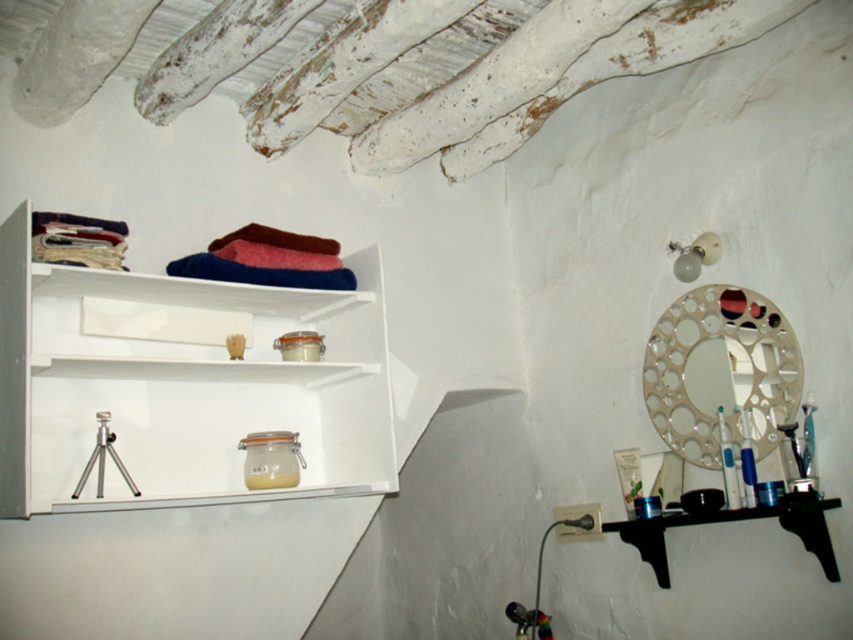
Is white glossy shelves at upper left to the right of black wood shelf at lower right from the viewer's perspective?

In fact, white glossy shelves at upper left is to the left of black wood shelf at lower right.

Is point (192, 355) positioned after point (770, 515)?

That is True.

Find the location of a particular element. This screenshot has width=853, height=640. white glossy shelves at upper left is located at coordinates (183, 387).

The image size is (853, 640). Describe the element at coordinates (720, 371) in the screenshot. I see `metallic circular mirror at upper right` at that location.

Is metallic circular mirror at upper right thinner than black wood shelf at lower right?

Yes, metallic circular mirror at upper right is thinner than black wood shelf at lower right.

Between point (769, 362) and point (827, 557), which one is positioned behind?

The point (769, 362) is more distant.

Image resolution: width=853 pixels, height=640 pixels. Find the location of `metallic circular mirror at upper right`. metallic circular mirror at upper right is located at coordinates (720, 371).

Does white glossy shelves at upper left have a lesser width compared to metallic circular mirror at upper right?

Incorrect, white glossy shelves at upper left's width is not less than metallic circular mirror at upper right's.

Is point (59, 426) positioned after point (698, 288)?

No, it is in front of (698, 288).

Does point (12, 490) come behind point (790, 352)?

No.

This screenshot has height=640, width=853. In order to click on white glossy shelves at upper left in this screenshot , I will do `click(183, 387)`.